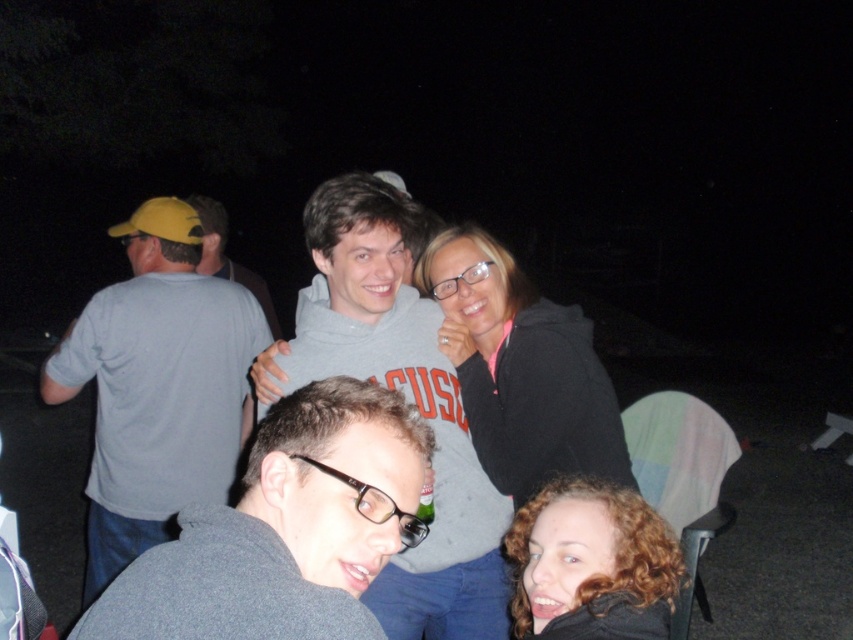
Question: Is gray cotton t-shirt at left positioned before black matte jacket at center?

Choices:
 (A) no
 (B) yes

Answer: (A)

Question: Which of the following is the farthest from the observer?

Choices:
 (A) (413, 221)
 (B) (218, 243)
 (C) (346, 380)

Answer: (B)

Question: Is gray cotton t-shirt at left to the right of black matte jacket at center from the viewer's perspective?

Choices:
 (A) yes
 (B) no

Answer: (B)

Question: Which of the following is the closest to the observer?

Choices:
 (A) gray matte hoodie at center
 (B) gray matte sweater at lower center

Answer: (B)

Question: Does gray matte sweater at lower center lie behind gray matte hoodie at center?

Choices:
 (A) no
 (B) yes

Answer: (A)

Question: Which point is closer to the camera taking this photo?

Choices:
 (A) (227, 333)
 (B) (576, 548)

Answer: (B)